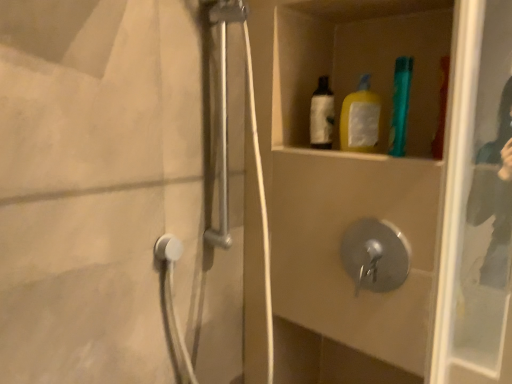
Question: Is metallic silver shower door at left spatially inside teal plastic toothbrush at upper right, or outside of it?

Choices:
 (A) inside
 (B) outside

Answer: (B)

Question: Relative to teal plastic toothbrush at upper right, is metallic silver shower door at left in front or behind?

Choices:
 (A) behind
 (B) front

Answer: (B)

Question: Which is nearer to the metallic silver shower door at left?

Choices:
 (A) teal plastic toothbrush at upper right
 (B) transparent glass screen door at upper right

Answer: (B)

Question: Considering the real-world distances, which object is farthest from the metallic silver shower door at left?

Choices:
 (A) transparent glass screen door at upper right
 (B) teal plastic toothbrush at upper right

Answer: (B)